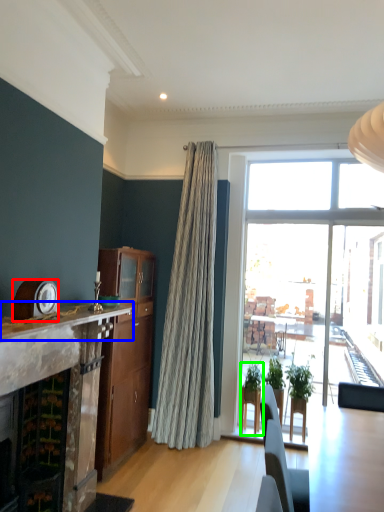
Question: Considering the real-world distances, which object is farthest from clock (highlighted by a red box)? mantle (highlighted by a blue box) or houseplant (highlighted by a green box)?

Choices:
 (A) mantle
 (B) houseplant

Answer: (B)